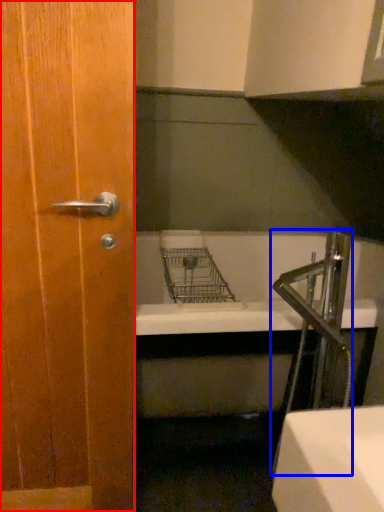
Question: Among these objects, which one is nearest to the camera, door (highlighted by a red box) or faucet (highlighted by a blue box)?

Choices:
 (A) door
 (B) faucet

Answer: (A)